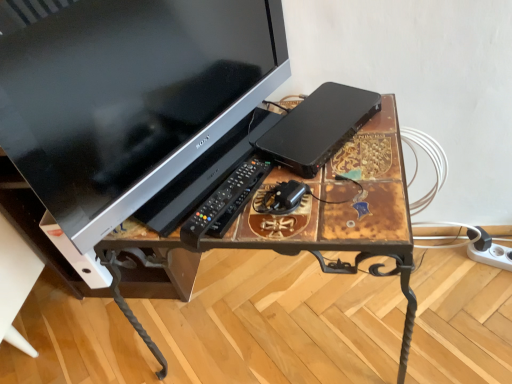
Identify the location of black plastic remote at center. This screenshot has height=384, width=512. (225, 202).

This screenshot has width=512, height=384. What do you see at coordinates (225, 202) in the screenshot?
I see `black plastic remote at center` at bounding box center [225, 202].

I want to click on white plastic extension cord at lower right, so click(492, 256).

You are a GUI agent. You are given a task and a screenshot of the screen. Output one action in this format:
    pyautogui.click(x=<x>, y=<y>)
    Task: Click on the black plastic power adapter at center
    The width and height of the screenshot is (512, 384).
    Given the screenshot: What is the action you would take?
    pyautogui.click(x=288, y=194)

What is the approximate height of black plastic computer at center?

1.43 inches.

Image resolution: width=512 pixels, height=384 pixels. What are the coordinates of `rustic wood desk at center` in the screenshot? It's located at (321, 215).

Between satin black monitor at upper left and rustic wood desk at center, which one appears on the right side from the viewer's perspective?

rustic wood desk at center.

In the image, is satin black monitor at upper left positioned in front of or behind rustic wood desk at center?

Visually, satin black monitor at upper left is located in front of rustic wood desk at center.

Measure the distance from satin black monitor at upper left to rustic wood desk at center.

satin black monitor at upper left is 9.99 inches from rustic wood desk at center.

From the image's perspective, is satin black monitor at upper left over rustic wood desk at center?

Yes, from the image's perspective, satin black monitor at upper left is above rustic wood desk at center.

Looking at this image, is black plastic computer at center not inside white plastic extension cord at lower right?

black plastic computer at center is positioned outside white plastic extension cord at lower right.

Is black plastic computer at center in front of or behind white plastic extension cord at lower right in the image?

black plastic computer at center is in front of white plastic extension cord at lower right.

Which is more to the right, black plastic computer at center or white plastic extension cord at lower right?

From the viewer's perspective, white plastic extension cord at lower right appears more on the right side.

Between black plastic computer at center and white plastic extension cord at lower right, which one has smaller width?

Thinner between the two is white plastic extension cord at lower right.

Can you confirm if white plastic extension cord at lower right is shorter than rustic wood desk at center?

Indeed, white plastic extension cord at lower right has a lesser height compared to rustic wood desk at center.

Which of these two, white plastic extension cord at lower right or rustic wood desk at center, is wider?

Wider between the two is rustic wood desk at center.

What's the angular difference between white plastic extension cord at lower right and rustic wood desk at center's facing directions?

The facing directions of white plastic extension cord at lower right and rustic wood desk at center are 21.7 degrees apart.

In the scene shown: Is white plastic extension cord at lower right in front of or behind rustic wood desk at center in the image?

white plastic extension cord at lower right is behind rustic wood desk at center.

From a real-world perspective, is black plastic power adapter at center beneath black plastic remote at center?

Yes, from a real-world perspective, black plastic power adapter at center is below black plastic remote at center.

Are black plastic power adapter at center and black plastic remote at center located far from each other?

black plastic power adapter at center is near black plastic remote at center, not far away.

Can you confirm if black plastic power adapter at center is taller than black plastic remote at center?

Yes, black plastic power adapter at center is taller than black plastic remote at center.

Locate an element on the screen. The height and width of the screenshot is (384, 512). computer monitor located above the black plastic computer at center (from a real-world perspective) is located at coordinates (130, 98).

Is black plastic computer at center at the left side of satin black monitor at upper left?

In fact, black plastic computer at center is to the right of satin black monitor at upper left.

Are black plastic computer at center and satin black monitor at upper left beside each other?

No, black plastic computer at center is not beside satin black monitor at upper left.

Considering the positions of objects black plastic computer at center and satin black monitor at upper left in the image provided, who is behind, black plastic computer at center or satin black monitor at upper left?

Positioned behind is black plastic computer at center.

Can you confirm if black plastic computer at center is taller than black plastic power adapter at center?

Yes.

Is point (346, 133) positioned in front of point (291, 194)?

That is False.

In the scene shown: From the image's perspective, relative to black plastic power adapter at center, is black plastic computer at center above or below?

Based on their image positions, black plastic computer at center is located above black plastic power adapter at center.

Is black plastic computer at center positioned beyond the bounds of black plastic power adapter at center?

Yes.

Is rustic wood desk at center at the left side of black plastic computer at center?

Correct, you'll find rustic wood desk at center to the left of black plastic computer at center.

Would you consider rustic wood desk at center to be distant from black plastic computer at center?

No, rustic wood desk at center is in close proximity to black plastic computer at center.

Is rustic wood desk at center positioned with its back to black plastic computer at center?

No, rustic wood desk at center's orientation is not away from black plastic computer at center.

Is rustic wood desk at center inside the boundaries of black plastic computer at center, or outside?

rustic wood desk at center is spatially situated outside black plastic computer at center.

Find the location of a particular element. desk below the satin black monitor at upper left (from a real-world perspective) is located at coordinates (321, 215).

Find the location of `extension cord on the right of black plastic computer at center`. extension cord on the right of black plastic computer at center is located at coordinates (492, 256).

Considering their positions, is black plastic computer at center positioned further to rustic wood desk at center than white plastic extension cord at lower right?

white plastic extension cord at lower right is further to rustic wood desk at center.

From the image, which object appears to be farther from white plastic extension cord at lower right, rustic wood desk at center or satin black monitor at upper left?

satin black monitor at upper left is positioned further to the anchor white plastic extension cord at lower right.

From the image, which object appears to be nearer to black plastic remote at center, black plastic computer at center or white plastic extension cord at lower right?

black plastic computer at center is closer to black plastic remote at center.

From the image, which object appears to be farther from satin black monitor at upper left, rustic wood desk at center or black plastic power adapter at center?

black plastic power adapter at center lies further to satin black monitor at upper left than the other object.

Considering their positions, is white plastic extension cord at lower right positioned closer to satin black monitor at upper left than rustic wood desk at center?

rustic wood desk at center is closer to satin black monitor at upper left.

Looking at the image, which one is located further to white plastic extension cord at lower right, black plastic computer at center or black plastic power adapter at center?

Among the two, black plastic power adapter at center is located further to white plastic extension cord at lower right.

Which object lies nearer to the anchor point satin black monitor at upper left, black plastic computer at center or white plastic extension cord at lower right?

black plastic computer at center lies closer to satin black monitor at upper left than the other object.

Estimate the real-world distances between objects in this image. Which object is closer to satin black monitor at upper left, black plastic power adapter at center or white plastic extension cord at lower right?

Based on the image, black plastic power adapter at center appears to be nearer to satin black monitor at upper left.

Identify the location of computer between black plastic remote at center and white plastic extension cord at lower right in the horizontal direction. The image size is (512, 384). (319, 127).

Where is `control that lies between black plastic computer at center and rustic wood desk at center from top to bottom`? The width and height of the screenshot is (512, 384). control that lies between black plastic computer at center and rustic wood desk at center from top to bottom is located at coordinates (225, 202).

The width and height of the screenshot is (512, 384). I want to click on computer between satin black monitor at upper left and white plastic extension cord at lower right in the horizontal direction, so click(x=319, y=127).

At what (x,y) coordinates should I click in order to perform the action: click on gadget situated between black plastic remote at center and white plastic extension cord at lower right from left to right. Please return your answer as a coordinate pair (x, y). Image resolution: width=512 pixels, height=384 pixels. Looking at the image, I should click on (288, 194).